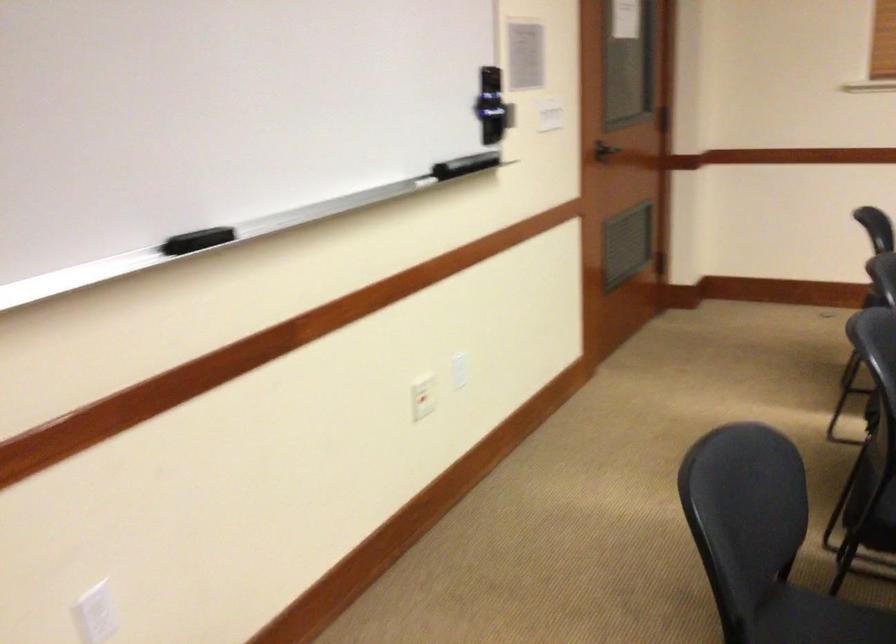
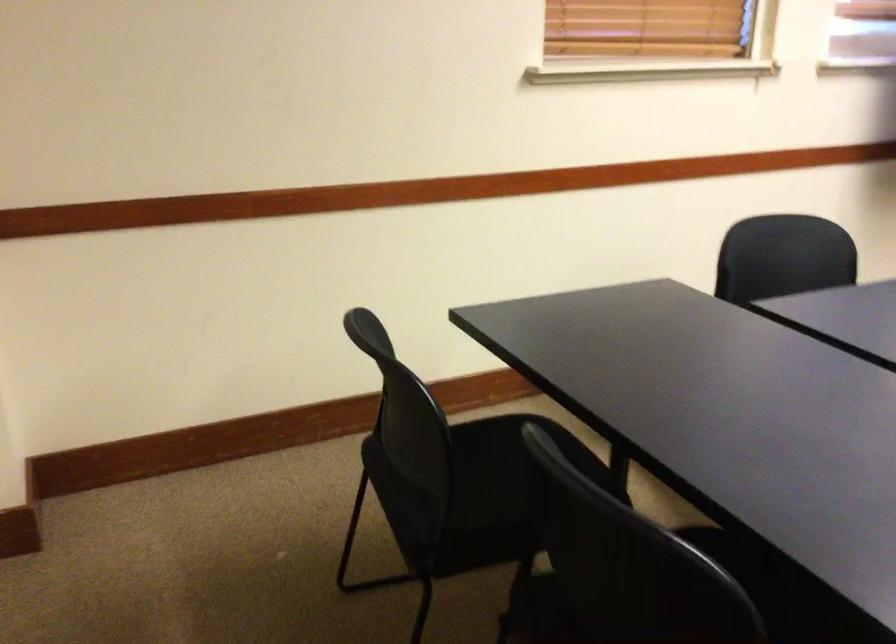
First-person continuous shooting, in which direction is the camera rotating?

The camera rotated toward right-down.